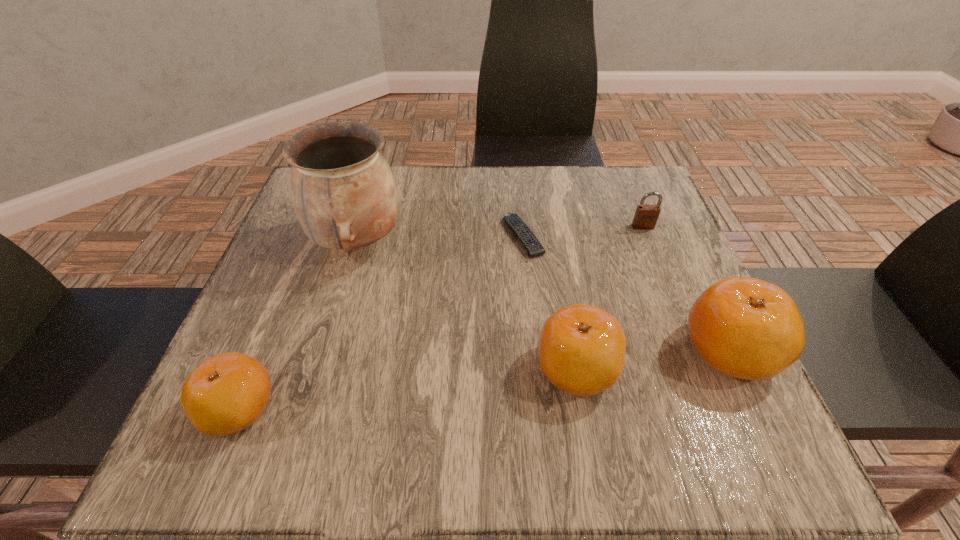
Find the location of `vacant region located on the front of the shortest object`. vacant region located on the front of the shortest object is located at coordinates pos(534,342).

The width and height of the screenshot is (960, 540). I want to click on free space located on the right of the tallest object, so click(x=536, y=241).

At what (x,y) coordinates should I click in order to perform the action: click on vacant space located 0.270m on the front-facing side of the padlock. Please return your answer as a coordinate pair (x, y). Looking at the image, I should click on (681, 321).

I want to click on remote control at the far edge, so click(534, 248).

I want to click on urn situated at the far edge, so click(x=344, y=195).

Image resolution: width=960 pixels, height=540 pixels. In order to click on clementine at the left edge in this screenshot , I will do `click(225, 394)`.

The width and height of the screenshot is (960, 540). I want to click on urn located in the left edge section of the desktop, so click(x=344, y=195).

Locate an element on the screen. Image resolution: width=960 pixels, height=540 pixels. clementine that is at the right edge is located at coordinates (747, 328).

You are a GUI agent. You are given a task and a screenshot of the screen. Output one action in this format:
    pyautogui.click(x=<x>, y=<y>)
    Task: Click on the padlock situated at the right edge
    The image size is (960, 540).
    Given the screenshot: What is the action you would take?
    pyautogui.click(x=646, y=216)

Image resolution: width=960 pixels, height=540 pixels. In order to click on object that is at the far left corner in this screenshot , I will do `click(344, 195)`.